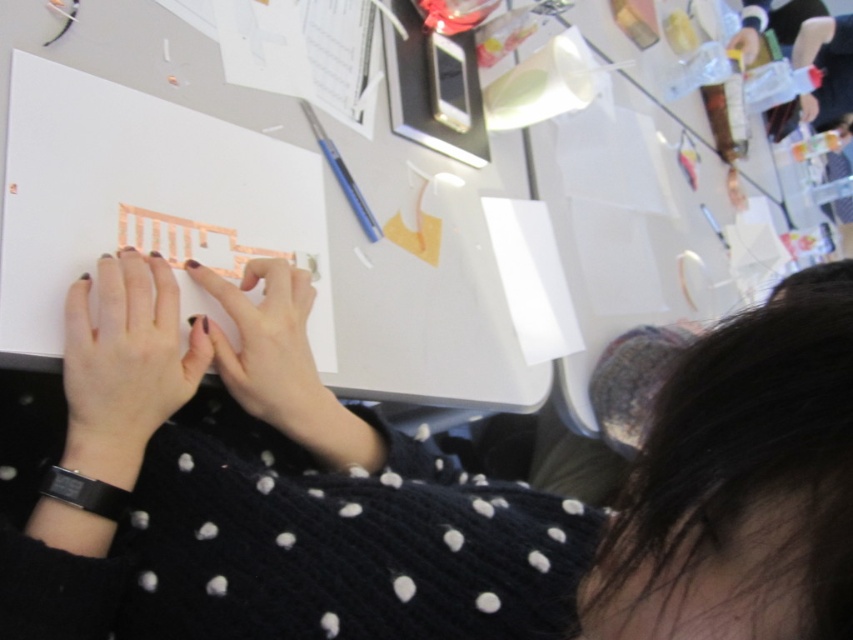
Can you confirm if nail polish matte hand at center is thinner than metallic gold paper at upper center?

Indeed, nail polish matte hand at center has a lesser width compared to metallic gold paper at upper center.

Is nail polish matte hand at center taller than metallic gold paper at upper center?

Incorrect, nail polish matte hand at center's height is not larger of metallic gold paper at upper center's.

Between point (238, 380) and point (735, 49), which one is positioned behind?

The point (735, 49) is behind.

What are the coordinates of `nail polish matte hand at center` in the screenshot? It's located at (268, 346).

Between black dotted sweater at center and blue plastic pencil at upper right, which one is positioned higher?

Positioned higher is blue plastic pencil at upper right.

Measure the distance between black dotted sweater at center and camera.

black dotted sweater at center and camera are 8.49 inches apart from each other.

Where is `black dotted sweater at center`? black dotted sweater at center is located at coordinates (425, 493).

Is blue plastic pencil at upper right taller than metallic gold paper at upper center?

No, blue plastic pencil at upper right is not taller than metallic gold paper at upper center.

Can you confirm if blue plastic pencil at upper right is positioned to the left of metallic gold paper at upper center?

Indeed, blue plastic pencil at upper right is positioned on the left side of metallic gold paper at upper center.

Who is more distant from viewer, (314, 118) or (743, 49)?

The point (743, 49) is more distant.

Where is `blue plastic pencil at upper right`? The image size is (853, 640). blue plastic pencil at upper right is located at coordinates (341, 176).